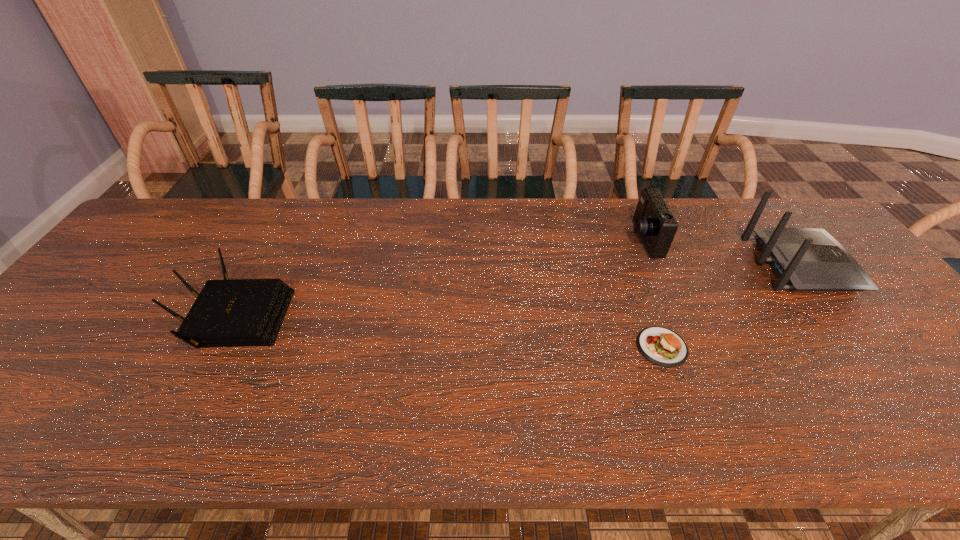
The image size is (960, 540). Find the location of `vacant area that lies between the left router and the camera`. vacant area that lies between the left router and the camera is located at coordinates [x=440, y=278].

The width and height of the screenshot is (960, 540). What are the coordinates of `free space between the rightmost object and the camera` in the screenshot? It's located at [722, 252].

Find the location of a particular element. blank region between the left router and the rightmost object is located at coordinates (517, 291).

The height and width of the screenshot is (540, 960). What are the coordinates of `blank region between the camera and the shorter router` in the screenshot? It's located at (440, 278).

Locate an element on the screen. free space between the camera and the tallest object is located at coordinates (722, 252).

Where is `free space between the shortest object and the tallest object`? The height and width of the screenshot is (540, 960). free space between the shortest object and the tallest object is located at coordinates (732, 306).

Find the location of a particular element. vacant area between the right router and the left router is located at coordinates (517, 291).

Identify the location of free area in between the shortest object and the right router. (732, 306).

Locate an element on the screen. The height and width of the screenshot is (540, 960). empty space that is in between the taller router and the camera is located at coordinates (722, 252).

Identify which object is located as the second nearest to the shortest object. Please provide its 2D coordinates. Your answer should be formatted as a tuple, i.e. [(x, y)], where the tuple contains the x and y coordinates of a point satisfying the conditions above.

[(807, 259)]